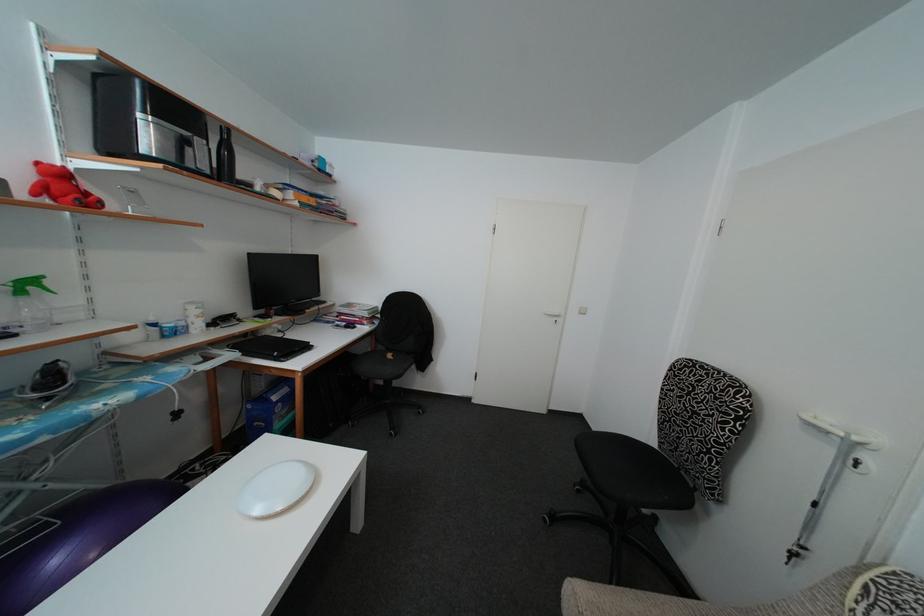
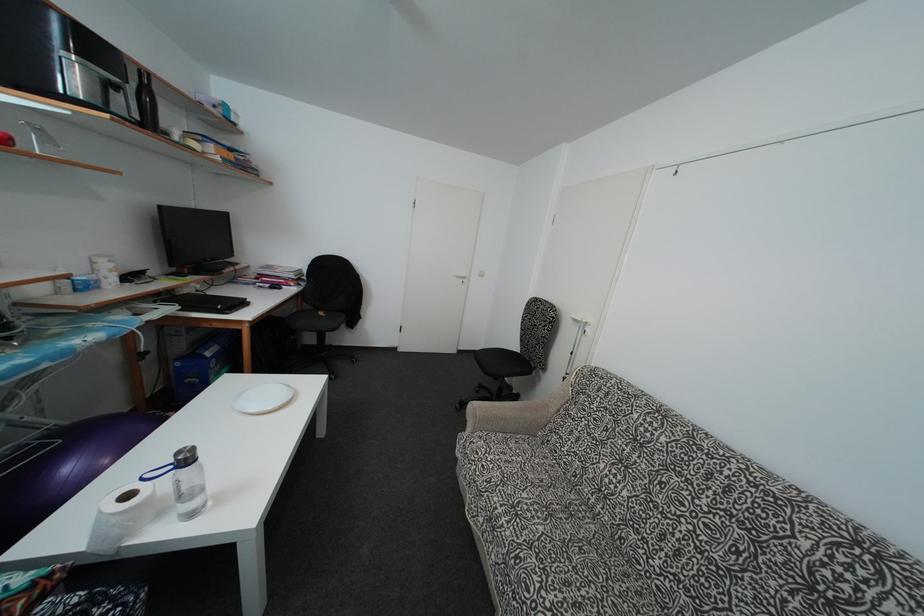
Find the pixel in the second image that matches point 229,182 in the first image.

(152, 131)